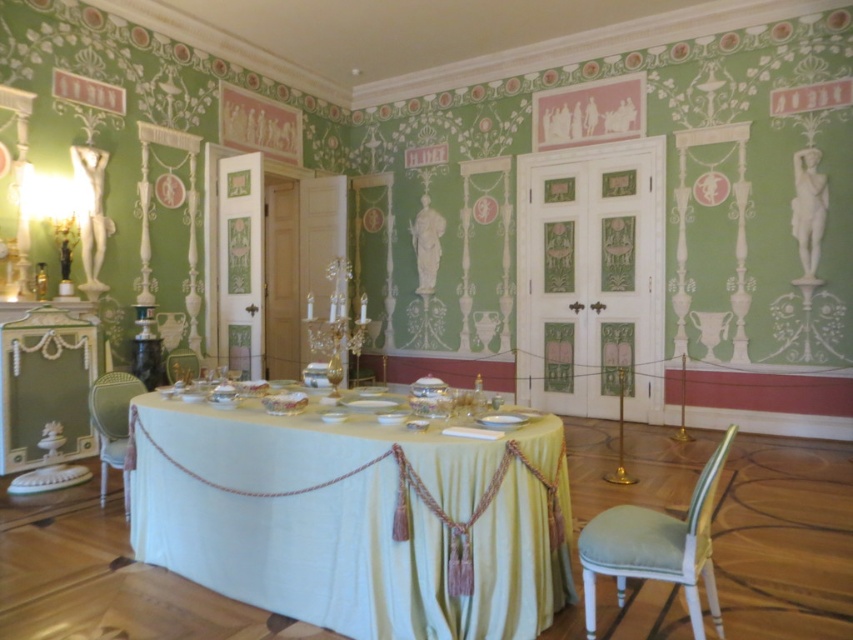
Does point (663, 538) come behind point (96, 429)?

That is False.

Is light green fabric chair at lower right closer to the viewer compared to light green fabric chair at lower left?

Yes, light green fabric chair at lower right is in front of light green fabric chair at lower left.

Does point (695, 548) come behind point (107, 403)?

No.

Image resolution: width=853 pixels, height=640 pixels. Find the location of `light green fabric chair at lower right`. light green fabric chair at lower right is located at coordinates (656, 547).

Between light green fabric chair at lower left and metallic gold chair at lower left, which one is positioned lower?

light green fabric chair at lower left is below.

Can you confirm if light green fabric chair at lower left is wider than metallic gold chair at lower left?

Indeed, light green fabric chair at lower left has a greater width compared to metallic gold chair at lower left.

I want to click on light green fabric chair at lower left, so click(x=112, y=422).

Does point (276, 593) come behind point (165, 372)?

That is False.

Who is more distant from viewer, (329,552) or (171,356)?

Point (171,356)

The width and height of the screenshot is (853, 640). Identify the location of white silk table at center. (357, 518).